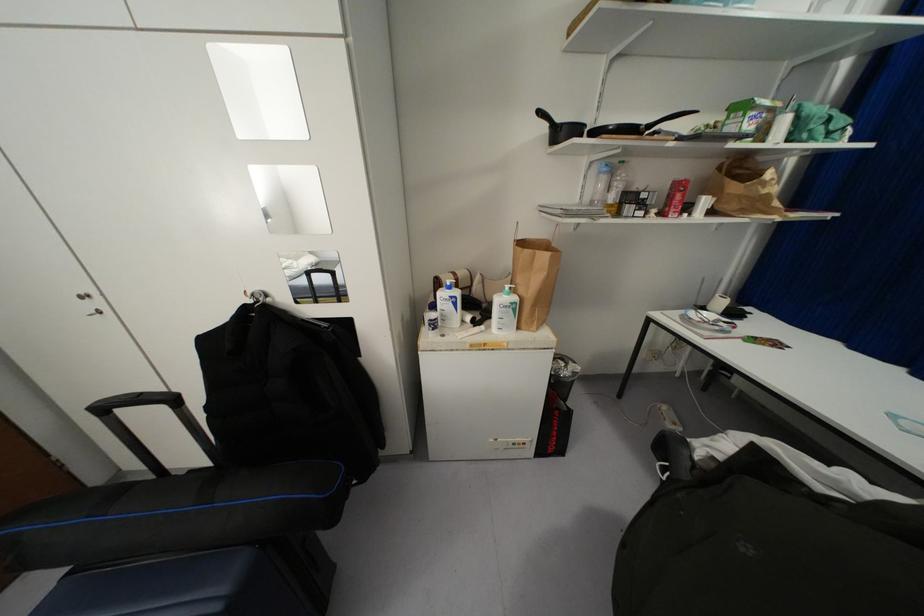
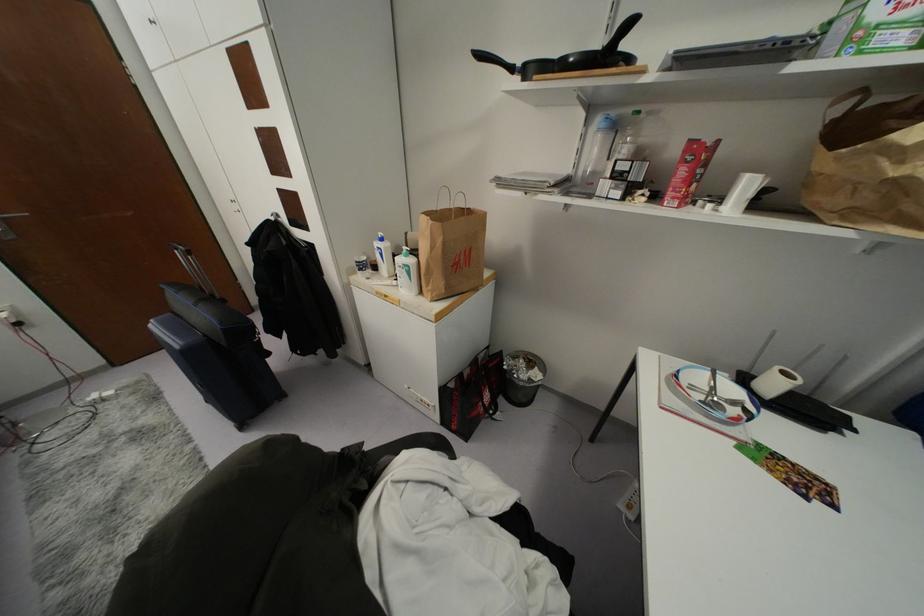
Locate, in the second image, the point that corresponds to point 598,172 in the first image.

(599, 130)